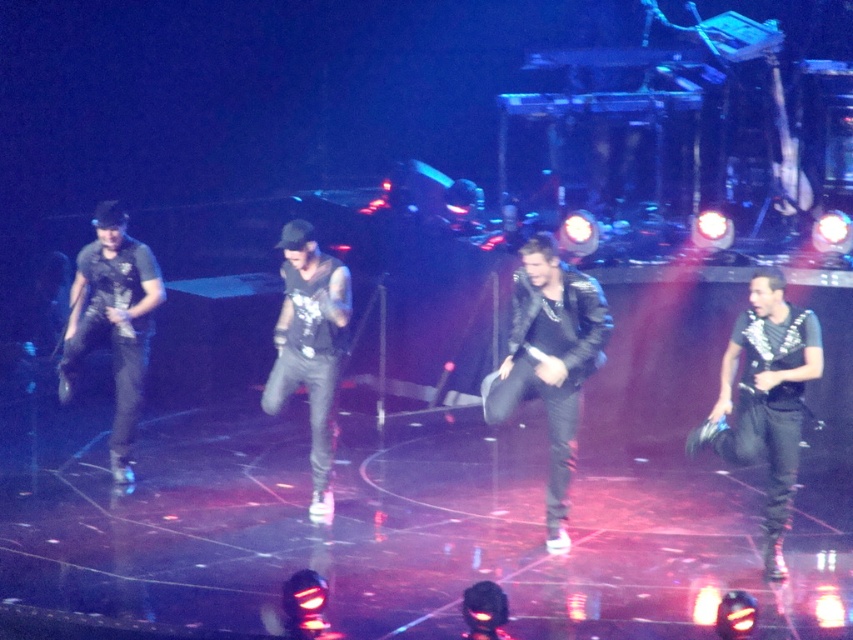
You are a photographer standing at the back of the stage. You want to take a photo of the matte black vest at left and the black leather pants at center. Which object will appear closer to you in the photo?

The matte black vest at left will appear closer to you in the photo because it is further to the viewer than the black leather pants at center.

You are a photographer at the back of the stage. You want to take a photo of the leather jacket at center and the black leather jacket at right. Which jacket is more to the left in the photo?

The leather jacket at center is more to the left in the photo because it is positioned on the left side of the black leather jacket at right.